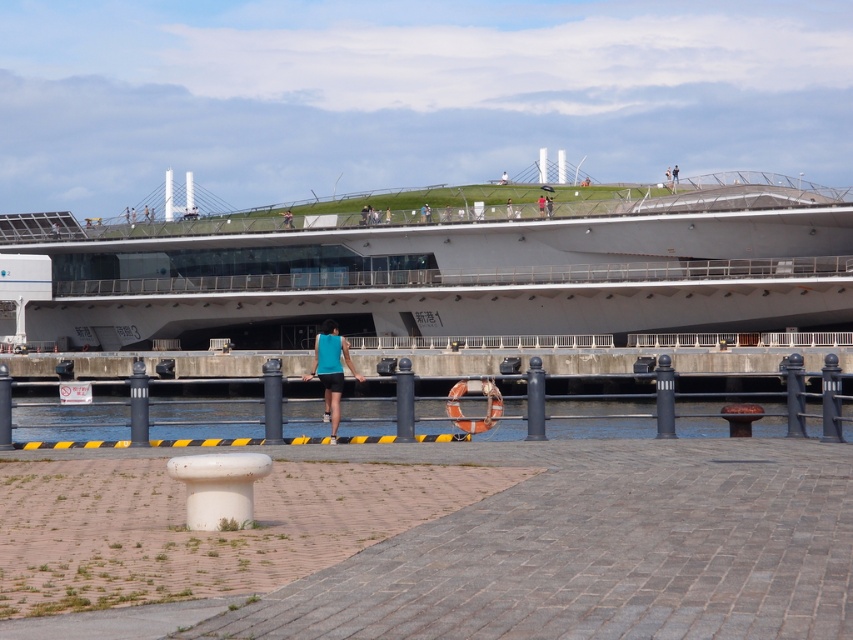
You are a photographer planning to capture the waterfront scene. You want to ensure that both the clear water at dock center and the teal fabric tank top at center are visible in your shot. Considering their sizes, which object should you focus on to frame the larger one properly?

The clear water at dock center is larger than the teal fabric tank top at center, so you should focus on framing the clear water at dock center to accommodate its larger size properly.

You are a photographer planning to capture the waterfront scene. You want to ensure that both the clear water at dock center and the teal fabric tank top at center are visible in your shot. Given their sizes, which object will occupy more space in the photo?

The clear water at dock center will occupy more space in the photo because its width is larger than that of the teal fabric tank top at center.

You are standing on the waterfront and want to take a photo of the clear water at dock center. Where exactly should you position yourself to capture it in the frame?

To capture the clear water at dock center, position yourself at point (x=71, y=422) as specified in the scene description.